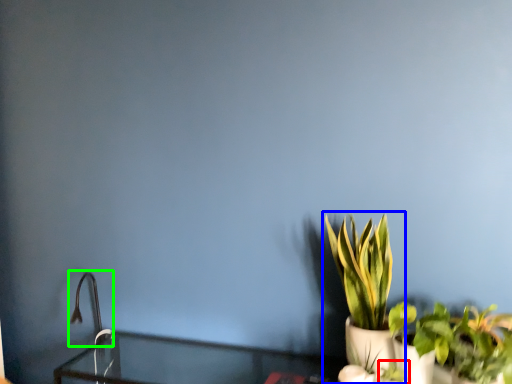
Question: Estimate the real-world distances between objects in this image. Which object is farther from plant (highlighted by a red box), houseplant (highlighted by a blue box) or faucet (highlighted by a green box)?

Choices:
 (A) houseplant
 (B) faucet

Answer: (B)